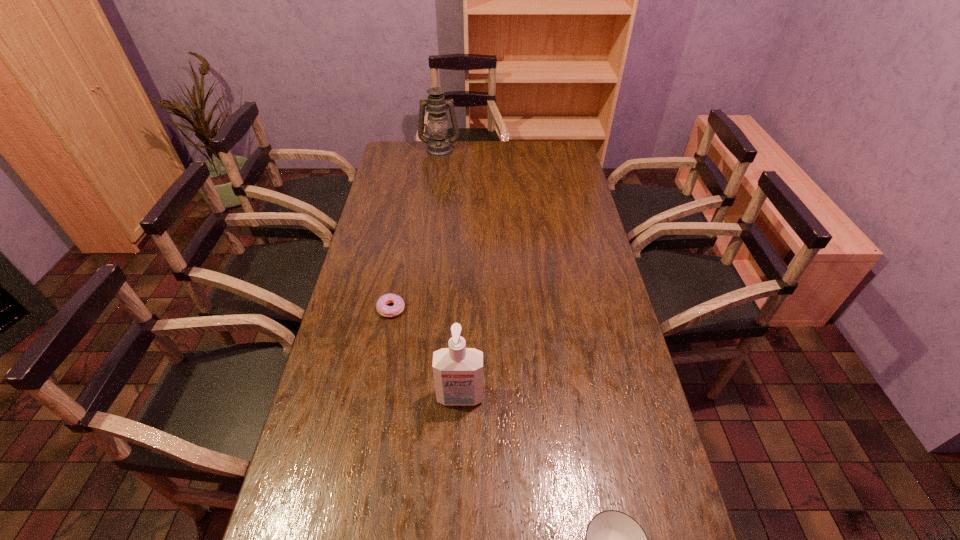
Where is `object located at the far left corner`? The image size is (960, 540). object located at the far left corner is located at coordinates (439, 145).

The height and width of the screenshot is (540, 960). Find the location of `free point at the far edge`. free point at the far edge is located at coordinates (519, 161).

Image resolution: width=960 pixels, height=540 pixels. Identify the location of vacant space at the left edge of the desktop. (389, 236).

You are a GUI agent. You are given a task and a screenshot of the screen. Output one action in this format:
    pyautogui.click(x=<x>, y=<y>)
    Task: Click on the free space at the right edge
    The height and width of the screenshot is (540, 960).
    Given the screenshot: What is the action you would take?
    pyautogui.click(x=569, y=249)

Where is `vacant space at the far left corner`? The height and width of the screenshot is (540, 960). vacant space at the far left corner is located at coordinates (412, 162).

Locate an element on the screen. This screenshot has height=540, width=960. free space at the far right corner of the desktop is located at coordinates (545, 150).

At what (x,y) coordinates should I click in order to perform the action: click on vacant region between the cleansing agent and the second farthest object. Please return your answer as a coordinate pair (x, y). The image size is (960, 540). Looking at the image, I should click on (425, 353).

Where is `free space between the cleansing agent and the shortest object`? The height and width of the screenshot is (540, 960). free space between the cleansing agent and the shortest object is located at coordinates (425, 353).

What are the coordinates of `object that can be found as the second closest to the third nearest object` in the screenshot? It's located at (613, 539).

Identify which object is the second nearest to the third farthest object. Please provide its 2D coordinates. Your answer should be formatted as a tuple, i.e. [(x, y)], where the tuple contains the x and y coordinates of a point satisfying the conditions above.

[(613, 539)]